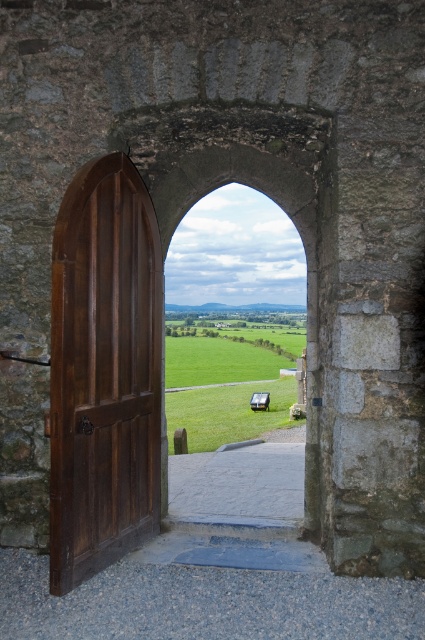
You are standing in front of the arched stone doorway. You notice the polished dark wood door at left and the green grass field at center. Which object takes up more space in the scene?

The green grass field at center takes up more space in the scene because the polished dark wood door at left is smaller than it.

You are standing in front of the arched stone doorway. You notice the polished dark wood door at left and the green grass field at center. Which object is taller?

The polished dark wood door at left is taller than the green grass field at center.

You are standing at the point labeled point (147, 520). You want to walk straight towards the camera. How far will you have to walk to reach the camera?

The distance between point (147, 520) and the camera is 4.35 meters, so you will have to walk 4.35 meters to reach the camera.